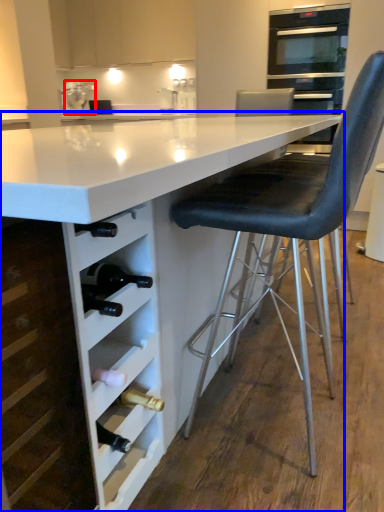
Question: Among these objects, which one is farthest to the camera, kitchen appliance (highlighted by a red box) or table (highlighted by a blue box)?

Choices:
 (A) kitchen appliance
 (B) table

Answer: (A)